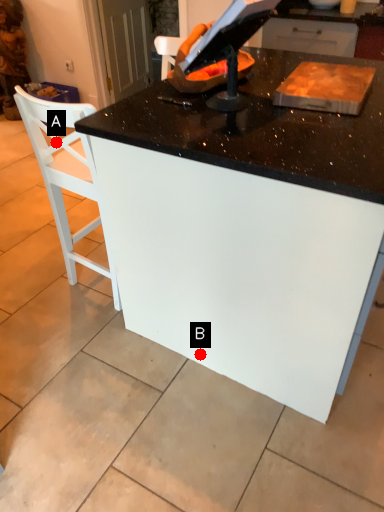
Question: Two points are circled on the image, labeled by A and B beside each circle. Which point is closer to the camera?

Choices:
 (A) A is closer
 (B) B is closer

Answer: (A)